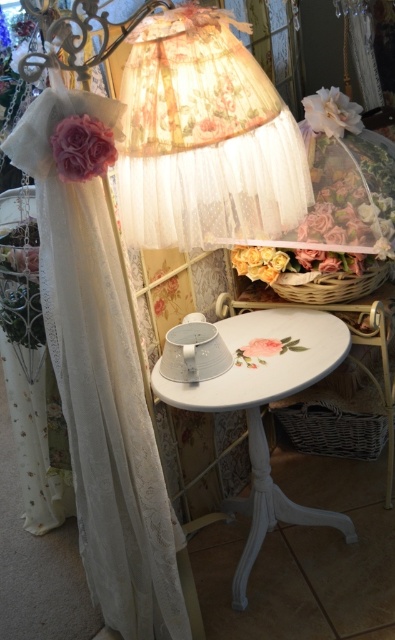
Question: Can you confirm if white lace curtain at left is smaller than pink fabric flower at center?

Choices:
 (A) no
 (B) yes

Answer: (A)

Question: Among these points, which one is nearest to the camera?

Choices:
 (A) tap(248, 52)
 (B) tap(242, 349)
 (C) tap(50, 260)
 (D) tap(73, 176)

Answer: (D)

Question: Does white lace curtain at left have a lesser width compared to white painted wood table at center?

Choices:
 (A) yes
 (B) no

Answer: (A)

Question: Considering the real-world distances, which object is farthest from the pink fabric flower at center?

Choices:
 (A) white painted wood table at center
 (B) white fabric flower at upper right
 (C) white lace curtain at left
 (D) pink fabric flower at left

Answer: (B)

Question: Which of the following is the farthest from the observer?

Choices:
 (A) pink fabric flower at left
 (B) floral lace lampshade at upper center
 (C) white fabric flower at upper right
 (D) white painted wood table at center

Answer: (C)

Question: Can you confirm if floral lace lampshade at upper center is wider than pink fabric flower at left?

Choices:
 (A) yes
 (B) no

Answer: (A)